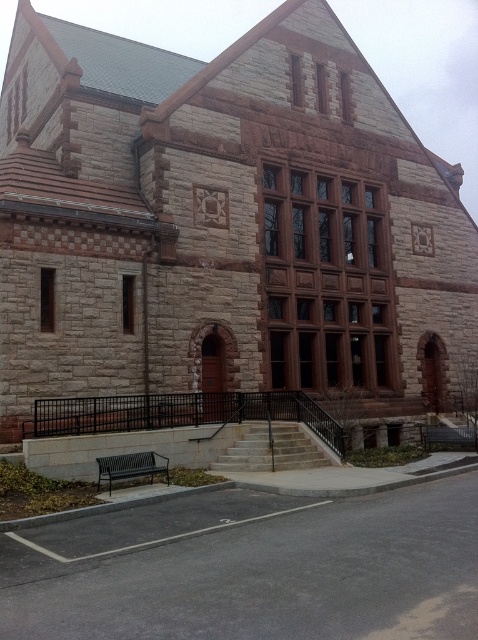
Can you confirm if brown stone church at center is wider than black metal bench at lower left?

Indeed, brown stone church at center has a greater width compared to black metal bench at lower left.

Which of these two, brown stone church at center or black metal bench at lower left, stands taller?

With more height is brown stone church at center.

The width and height of the screenshot is (478, 640). Identify the location of brown stone church at center. (224, 221).